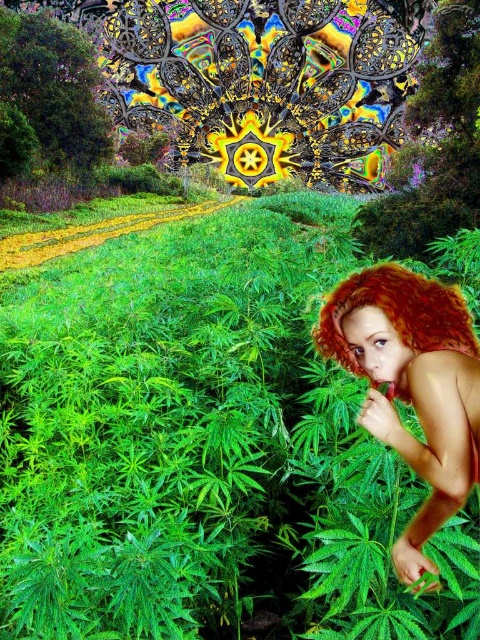
Consider the image. You are an observer standing in the surreal scene. You notice the green leafy grass at center and the shiny red hair at right. Which object is nearer to you?

The green leafy grass at center is closer to the viewer than the shiny red hair at right.

You are an artist observing the surreal scene. You notice the green leafy grass at center and the vibrant red hair at right. Which object is positioned higher in the image?

The green leafy grass at center is positioned higher than the vibrant red hair at right in the image.

In the surreal image with a vibrant green field and an abstract sky, there is a point labeled as point [204,445]. What does this point represent?

The point [204,445] marks the green leafy grass at center.